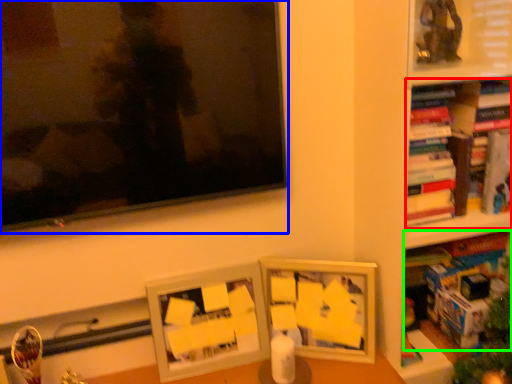
Question: Which is nearer to the book (highlighted by a red box)? television (highlighted by a blue box) or book (highlighted by a green box).

Choices:
 (A) television
 (B) book

Answer: (B)